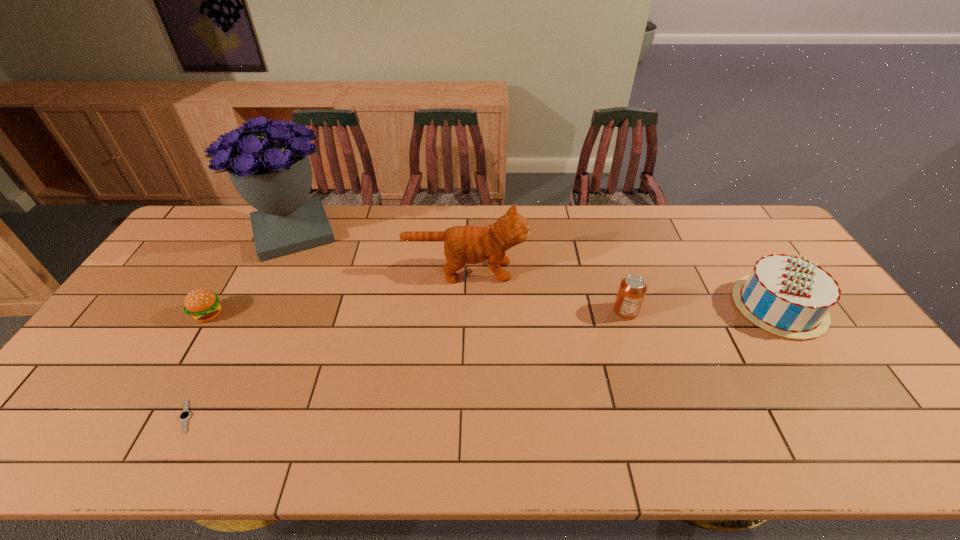
The image size is (960, 540). In order to click on free spot between the tallest object and the birthday cake in this screenshot , I will do `click(536, 269)`.

What are the coordinates of `blank region between the shortest object and the cat` in the screenshot? It's located at (325, 343).

Identify which object is located as the third nearest to the bouquet. Please provide its 2D coordinates. Your answer should be formatted as a tuple, i.e. [(x, y)], where the tuple contains the x and y coordinates of a point satisfying the conditions above.

[(184, 416)]

At what (x,y) coordinates should I click in order to perform the action: click on the fifth closest object relative to the shortest object. Please return your answer as a coordinate pair (x, y). The image size is (960, 540). Looking at the image, I should click on (788, 296).

You are a GUI agent. You are given a task and a screenshot of the screen. Output one action in this format:
    pyautogui.click(x=<x>, y=<y>)
    Task: Click on the free spot that satisfies the following two spatial constraints: 1. on the face of the rightmost object; 2. on the left side of the cat
    This screenshot has height=540, width=960.
    Given the screenshot: What is the action you would take?
    pyautogui.click(x=465, y=306)

Locate an element on the screen. vacant space that satisfies the following two spatial constraints: 1. on the face of the fifth shortest object; 2. on the right side of the birthday cake is located at coordinates (465, 306).

Where is `vacant area that satisfies the following two spatial constraints: 1. on the face of the cat; 2. on the front side of the nearest object`? vacant area that satisfies the following two spatial constraints: 1. on the face of the cat; 2. on the front side of the nearest object is located at coordinates (461, 416).

Identify the location of free space that satisfies the following two spatial constraints: 1. on the face of the cat; 2. on the right side of the second object from right to left. The width and height of the screenshot is (960, 540). (464, 311).

You are a GUI agent. You are given a task and a screenshot of the screen. Output one action in this format:
    pyautogui.click(x=<x>, y=<y>)
    Task: Click on the free space that satisfies the following two spatial constraints: 1. on the back side of the nearest object; 2. on the left side of the birthday cake
    The height and width of the screenshot is (540, 960).
    Given the screenshot: What is the action you would take?
    pyautogui.click(x=243, y=306)